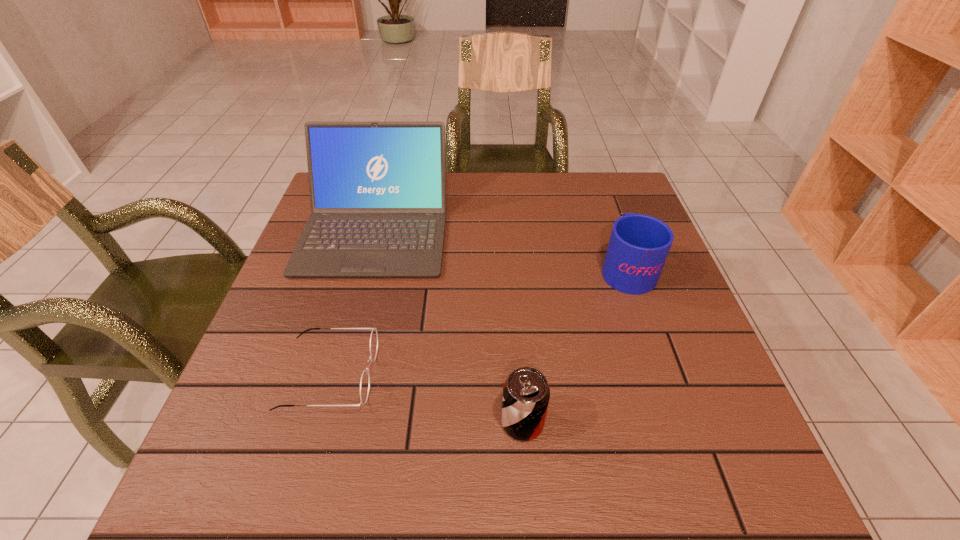
You are a GUI agent. You are given a task and a screenshot of the screen. Output one action in this format:
    pyautogui.click(x=<x>, y=<y>)
    Task: Click on the blank space at the far right corner of the desktop
    
    Given the screenshot: What is the action you would take?
    pyautogui.click(x=579, y=180)

I want to click on vacant space at the near right corner of the desktop, so click(697, 496).

Identify the location of free spot between the rightmost object and the laptop computer. The width and height of the screenshot is (960, 540). (501, 249).

Locate an element on the screen. This screenshot has height=540, width=960. blank region between the mug and the spectacles is located at coordinates (478, 321).

At what (x,y) coordinates should I click in order to perform the action: click on empty location between the rightmost object and the spectacles. Please return your answer as a coordinate pair (x, y). This screenshot has height=540, width=960. Looking at the image, I should click on (478, 321).

Locate an element on the screen. This screenshot has width=960, height=540. empty space between the mug and the shortest object is located at coordinates (478, 321).

Where is `vacant region between the mug and the tallest object`? This screenshot has width=960, height=540. vacant region between the mug and the tallest object is located at coordinates (501, 249).

This screenshot has height=540, width=960. I want to click on vacant region between the shortest object and the mug, so click(478, 321).

Identify the location of vacant space in between the shortest object and the mug. (478, 321).

The height and width of the screenshot is (540, 960). What are the coordinates of `blank region between the laptop computer and the third object from left to right` in the screenshot? It's located at (449, 326).